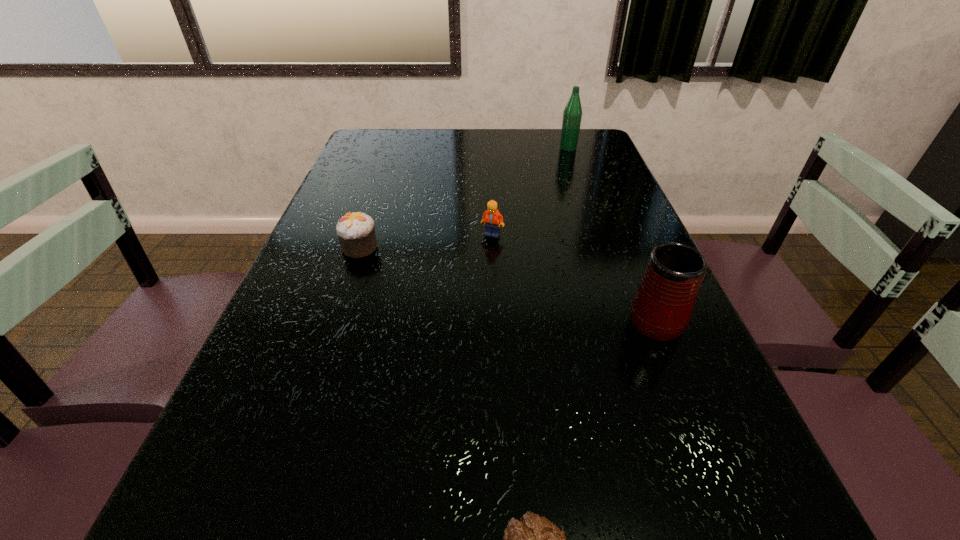
This screenshot has height=540, width=960. Find the location of `free space at the right edge`. free space at the right edge is located at coordinates click(x=606, y=292).

I want to click on vacant space at the far left corner of the desktop, so (x=380, y=133).

In the image, there is a desktop. What are the coordinates of `blank space at the far right corner` in the screenshot? It's located at (559, 150).

Identify the location of free point between the Lego and the tallest object. Image resolution: width=960 pixels, height=540 pixels. (530, 191).

I want to click on free area in between the cupcake and the mug, so click(x=506, y=281).

You are a GUI agent. You are given a task and a screenshot of the screen. Output one action in this format:
    pyautogui.click(x=<x>, y=<y>)
    Task: Click on the vacant space in between the Lego and the tallest object
    Image resolution: width=960 pixels, height=540 pixels.
    Given the screenshot: What is the action you would take?
    pyautogui.click(x=530, y=191)

Image resolution: width=960 pixels, height=540 pixels. I want to click on empty space that is in between the leftmost object and the second tallest object, so click(x=506, y=281).

I want to click on free space between the leftmost object and the second nearest object, so click(x=506, y=281).

The image size is (960, 540). I want to click on vacant region between the farthest object and the Lego, so click(530, 191).

Identify the location of the closest object to the nearest object. The height and width of the screenshot is (540, 960). (661, 308).